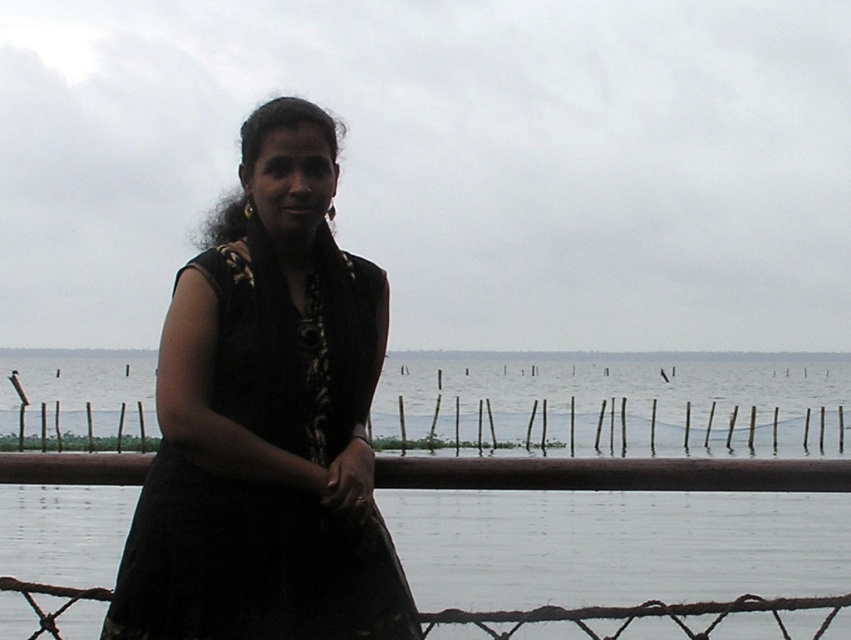
Which of these two, transparent water at center or black fabric dress at center, stands taller?

transparent water at center is taller.

Locate an element on the screen. This screenshot has height=640, width=851. transparent water at center is located at coordinates (610, 544).

You are a GUI agent. You are given a task and a screenshot of the screen. Output one action in this format:
    pyautogui.click(x=<x>, y=<y>)
    Task: Click on the transparent water at center
    The width and height of the screenshot is (851, 640).
    Given the screenshot: What is the action you would take?
    click(610, 544)

Which is below, transparent water at center or bamboo fence at center?

bamboo fence at center is lower down.

From the picture: Can you confirm if transparent water at center is positioned to the left of bamboo fence at center?

Yes, transparent water at center is to the left of bamboo fence at center.

Who is more distant from viewer, (509, 582) or (6, 449)?

The point (6, 449) is more distant.

This screenshot has height=640, width=851. What are the coordinates of `transparent water at center` in the screenshot? It's located at (610, 544).

Is point (174, 554) positioned after point (711, 416)?

No, (174, 554) is in front of (711, 416).

Can you confirm if black fabric dress at center is positioned to the right of bamboo fence at center?

Incorrect, black fabric dress at center is not on the right side of bamboo fence at center.

Identify the location of black fabric dress at center. This screenshot has height=640, width=851. [250, 564].